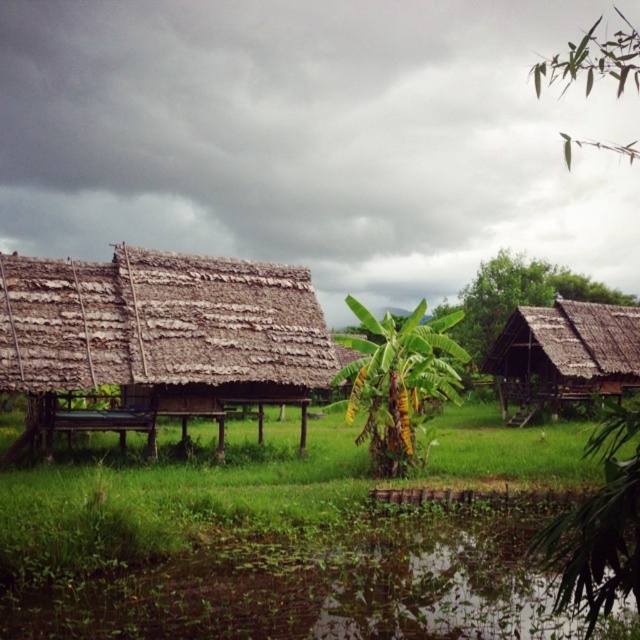
Question: Which of the following is the closest to the observer?

Choices:
 (A) green grass at lower center
 (B) green leafy tree at upper right
 (C) green muddy water at lower center

Answer: (B)

Question: Which object is positioned closest to the green leafy tree at right?

Choices:
 (A) thatched bamboo hut at right
 (B) green muddy water at lower center
 (C) thatched straw hut at left

Answer: (A)

Question: Is the position of green muddy water at lower center less distant than that of green leafy tree at right?

Choices:
 (A) no
 (B) yes

Answer: (B)

Question: Which of these objects is positioned closest to the thatched bamboo hut at right?

Choices:
 (A) green leafy tree at upper right
 (B) green leafy plant at center
 (C) green grass at lower center

Answer: (C)

Question: Can you confirm if thatched straw hut at left is positioned to the left of green leafy tree at upper right?

Choices:
 (A) yes
 (B) no

Answer: (A)

Question: Does green leafy plant at center have a larger size compared to green leafy tree at right?

Choices:
 (A) yes
 (B) no

Answer: (B)